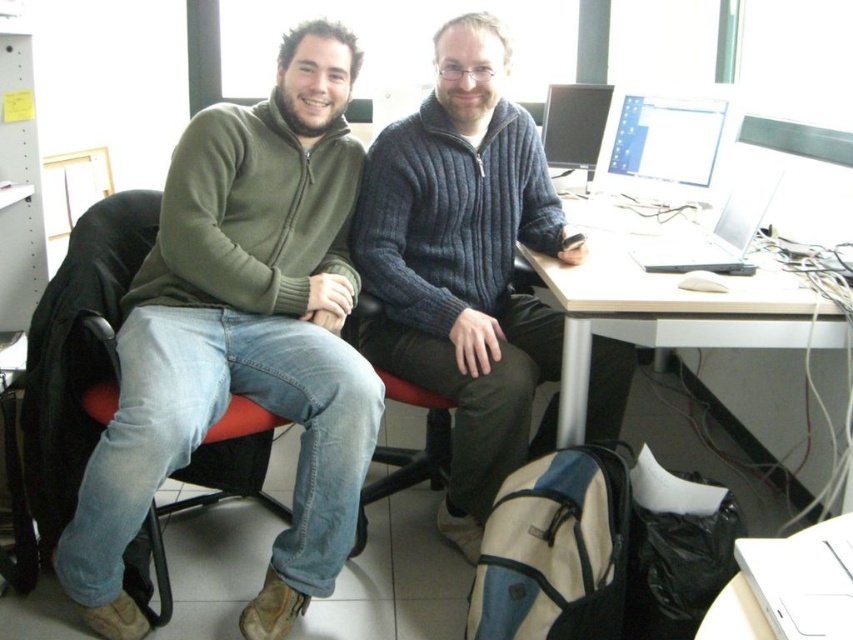
You are a new employee in an office and need to sit in the red fabric chair at center to start your work. However, there is a matte black monitor at center in the way. Can you sit down without moving the monitor?

The red fabric chair at center is below the matte black monitor at center, so you can sit in the red fabric chair at center without moving the matte black monitor at center because it is positioned above the chair.

You are trying to decide whether to place a new rectangular box that is 1.2 meters wide on the desk between the red fabric chair at center and the matte plastic monitor at upper right. Can the box fit horizontally between them without overlapping either object?

The red fabric chair at center is wider than the matte plastic monitor at upper right. Since the box is 1.2 meters wide, but the distance between the two objects isn answer the description only states their widths, not the distance between them. Therefore, it is impossible to determine if the box will fit based on the given information.

You are a delivery person who needs to place a small package between the red fabric chair at center and the matte black monitor at center. Can you fit the package there if it measures 3 feet in length?

The distance between the red fabric chair at center and the matte black monitor at center is 3.51 feet. Since the package is 3 feet long, it can fit between them as there is enough space.